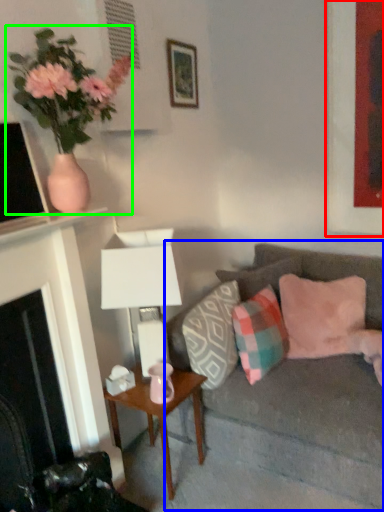
Question: Based on their relative distances, which object is farther from picture frame (highlighted by a red box)? Choose from studio couch (highlighted by a blue box) and houseplant (highlighted by a green box).

Choices:
 (A) studio couch
 (B) houseplant

Answer: (B)